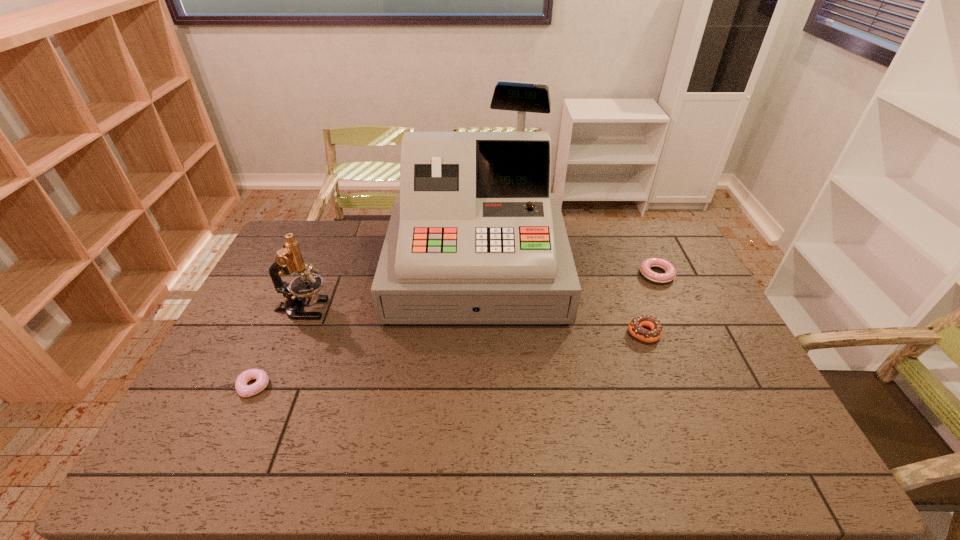
Where is `free space between the nearest object and the third object from right to left`? The width and height of the screenshot is (960, 540). free space between the nearest object and the third object from right to left is located at coordinates (366, 328).

Locate an element on the screen. This screenshot has width=960, height=540. empty space that is in between the farthest doughnut and the leftmost doughnut is located at coordinates (455, 330).

The width and height of the screenshot is (960, 540). In order to click on the third closest object relative to the nearest doughnut in this screenshot , I will do `click(635, 327)`.

Where is `object that stands as the closest to the tallest object`? The width and height of the screenshot is (960, 540). object that stands as the closest to the tallest object is located at coordinates (635, 327).

Identify the location of doughnut identified as the second closest to the tallest doughnut. (244, 390).

The height and width of the screenshot is (540, 960). Identify the location of doughnut that is the closest to the third object from right to left. (635, 327).

The height and width of the screenshot is (540, 960). I want to click on free space in the image that satisfies the following two spatial constraints: 1. on the keypad side of the cash register; 2. at the eyepiece of the fourth shortest object, so click(x=476, y=309).